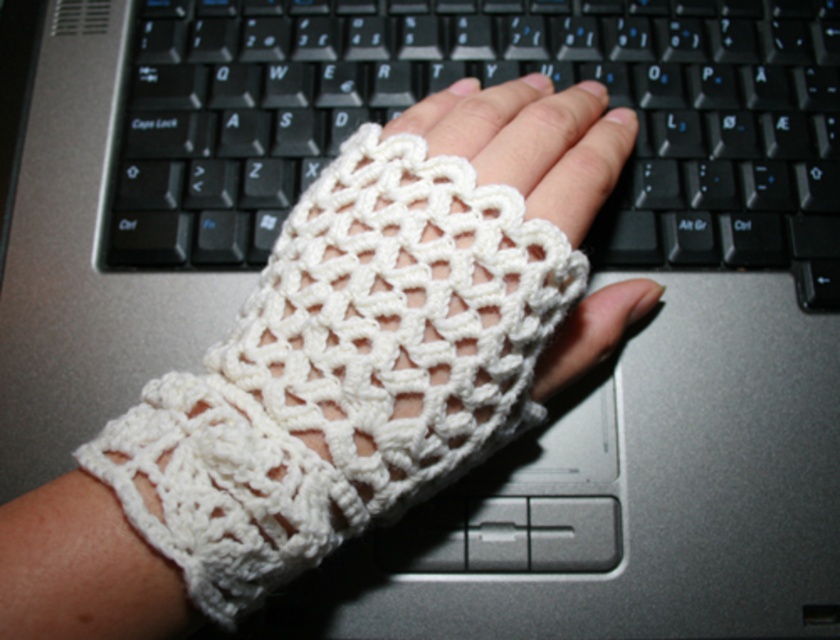
Question: Is black plastic keyboard at center to the left of white crochet fingerless glove at center from the viewer's perspective?

Choices:
 (A) no
 (B) yes

Answer: (B)

Question: Can you confirm if black plastic keyboard at center is positioned to the right of white crochet fingerless glove at center?

Choices:
 (A) no
 (B) yes

Answer: (A)

Question: Which point is farther to the camera?

Choices:
 (A) black plastic keyboard at center
 (B) white crochet fingerless glove at center

Answer: (A)

Question: Which point appears farthest from the camera in this image?

Choices:
 (A) (662, 221)
 (B) (576, 92)

Answer: (A)

Question: Which object appears closest to the camera in this image?

Choices:
 (A) black plastic keyboard at center
 (B) white crochet fingerless glove at center

Answer: (B)

Question: Is black plastic keyboard at center above white crochet fingerless glove at center?

Choices:
 (A) no
 (B) yes

Answer: (B)